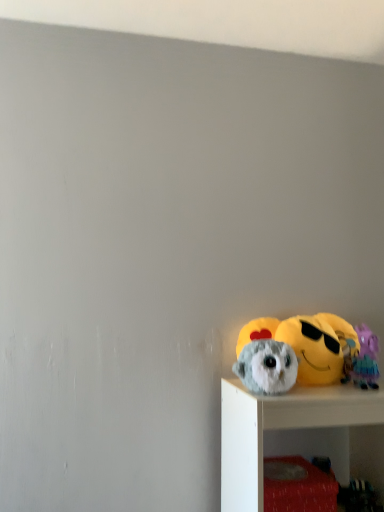
Question: Are fluffy gray owl at lower right, which is counted as the second toy, starting from the left, and purple plush toy at right, the first toy positioned from the right, far apart?

Choices:
 (A) yes
 (B) no

Answer: (B)

Question: Does fluffy gray owl at lower right, which is counted as the second toy, starting from the left, have a larger size compared to purple plush toy at right, which is the third toy in left-to-right order?

Choices:
 (A) yes
 (B) no

Answer: (A)

Question: Can you confirm if fluffy gray owl at lower right, the second toy when ordered from right to left, is smaller than purple plush toy at right, the first toy positioned from the right?

Choices:
 (A) no
 (B) yes

Answer: (A)

Question: Can you confirm if fluffy gray owl at lower right, the second toy when ordered from right to left, is shorter than purple plush toy at right, the first toy positioned from the right?

Choices:
 (A) no
 (B) yes

Answer: (A)

Question: Is purple plush toy at right, the first toy positioned from the right, a part of fluffy gray owl at lower right, which is counted as the second toy, starting from the left?

Choices:
 (A) yes
 (B) no

Answer: (B)

Question: Is fluffy gray owl at lower right, which is counted as the second toy, starting from the left, bigger or smaller than purple plush toy at right, the first toy positioned from the right?

Choices:
 (A) big
 (B) small

Answer: (A)

Question: Considering the relative positions of fluffy gray owl at lower right, which is counted as the second toy, starting from the left, and purple plush toy at right, which is the third toy in left-to-right order, in the image provided, is fluffy gray owl at lower right, which is counted as the second toy, starting from the left, to the left or to the right of purple plush toy at right, which is the third toy in left-to-right order,?

Choices:
 (A) right
 (B) left

Answer: (B)

Question: Is point (294, 316) positioned closer to the camera than point (357, 358)?

Choices:
 (A) farther
 (B) closer

Answer: (A)

Question: From the image's perspective, is fluffy gray owl at lower right, which is counted as the second toy, starting from the left, located above or below purple plush toy at right, the first toy positioned from the right?

Choices:
 (A) above
 (B) below

Answer: (A)

Question: Does point (362, 373) appear closer or farther from the camera than point (331, 330)?

Choices:
 (A) closer
 (B) farther

Answer: (A)

Question: Looking at the image, does purple plush toy at right, which is the third toy in left-to-right order, seem bigger or smaller compared to fluffy gray owl at lower right, the second toy when ordered from right to left?

Choices:
 (A) small
 (B) big

Answer: (A)

Question: From the image's perspective, is purple plush toy at right, the first toy positioned from the right, located above or below fluffy gray owl at lower right, which is counted as the second toy, starting from the left?

Choices:
 (A) above
 (B) below

Answer: (B)

Question: Considering their positions, is purple plush toy at right, the first toy positioned from the right, located in front of or behind fluffy gray owl at lower right, which is counted as the second toy, starting from the left?

Choices:
 (A) behind
 (B) front

Answer: (B)

Question: Is purple plush toy at right, the first toy positioned from the right, to the left or to the right of fluffy gray plush at lower right, positioned as the first toy in left-to-right order, in the image?

Choices:
 (A) right
 (B) left

Answer: (A)

Question: Is purple plush toy at right, which is the third toy in left-to-right order, in front of or behind fluffy gray plush at lower right, positioned as the first toy in left-to-right order, in the image?

Choices:
 (A) front
 (B) behind

Answer: (B)